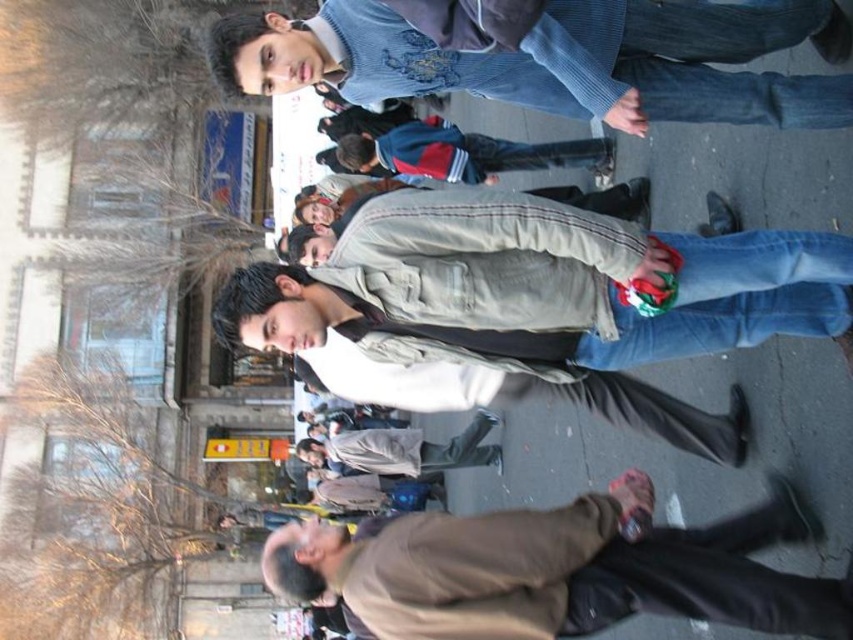
Find the location of a particular element. Image resolution: width=853 pixels, height=640 pixels. denim jeans at center is located at coordinates (546, 282).

Who is positioned more to the right, denim jeans at center or light brown leather jacket at center?

Positioned to the right is denim jeans at center.

Which is behind, point (741, 323) or point (343, 468)?

Positioned behind is point (343, 468).

Where is `denim jeans at center`? The width and height of the screenshot is (853, 640). denim jeans at center is located at coordinates (546, 282).

Does denim jeans at center appear on the left side of brown matte jacket at lower right?

Incorrect, denim jeans at center is not on the left side of brown matte jacket at lower right.

This screenshot has height=640, width=853. What do you see at coordinates (546, 282) in the screenshot?
I see `denim jeans at center` at bounding box center [546, 282].

Is point (454, 320) positioned in front of point (827, 628)?

No.

Image resolution: width=853 pixels, height=640 pixels. I want to click on denim jeans at center, so click(546, 282).

Based on the photo, can you confirm if light blue knitted sweater at upper center is taller than dark blue jacket at center?

In fact, light blue knitted sweater at upper center may be shorter than dark blue jacket at center.

Is point (457, 84) more distant than point (604, 172)?

No, it is in front of (604, 172).

Find the location of a particular element. The image size is (853, 640). light blue knitted sweater at upper center is located at coordinates (550, 56).